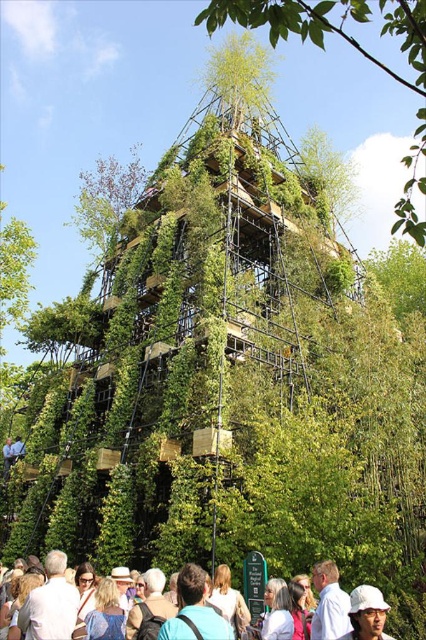
Question: Can you confirm if green leafy structure at center is positioned below light blue shirt at lower center?

Choices:
 (A) no
 (B) yes

Answer: (A)

Question: Considering the real-world distances, which object is farthest from the white shirt at lower left?

Choices:
 (A) light blue shirt at lower center
 (B) white matte hat at center
 (C) white cotton shirt at lower center
 (D) green leafy structure at center

Answer: (D)

Question: Does green leafy structure at center have a greater width compared to white shirt at lower left?

Choices:
 (A) no
 (B) yes

Answer: (B)

Question: Among these objects, which one is farthest from the camera?

Choices:
 (A) green leafy structure at center
 (B) light brown hair at center

Answer: (B)

Question: Is light brown hair at center closer to the viewer compared to white matte hat at center?

Choices:
 (A) yes
 (B) no

Answer: (A)

Question: Which is farther from the light brown hair at center?

Choices:
 (A) white shirt at lower left
 (B) white matte hat at center
 (C) white cotton shirt at lower center

Answer: (A)